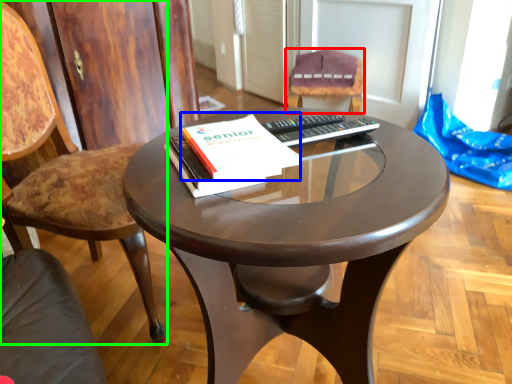
Question: Which object is positioned farthest from chair (highlighted by a red box)? Select from paperback book (highlighted by a blue box) and chair (highlighted by a green box).

Choices:
 (A) paperback book
 (B) chair

Answer: (A)